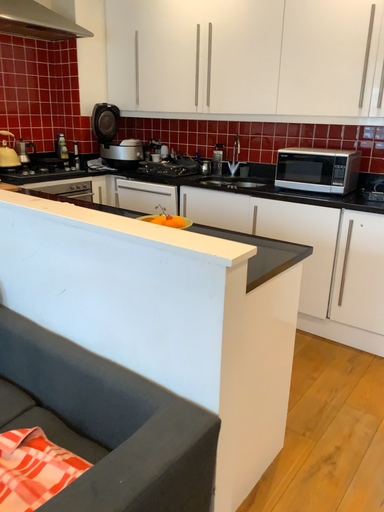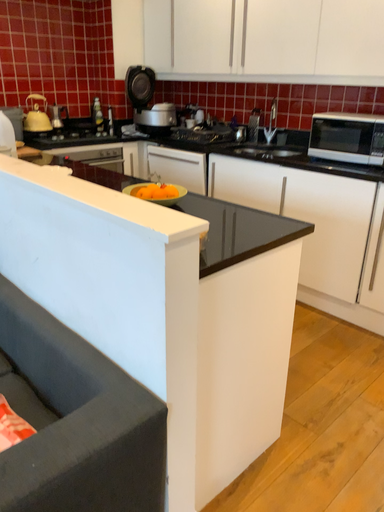
Question: How did the camera likely rotate when shooting the video?

Choices:
 (A) rotated right
 (B) rotated left

Answer: (B)